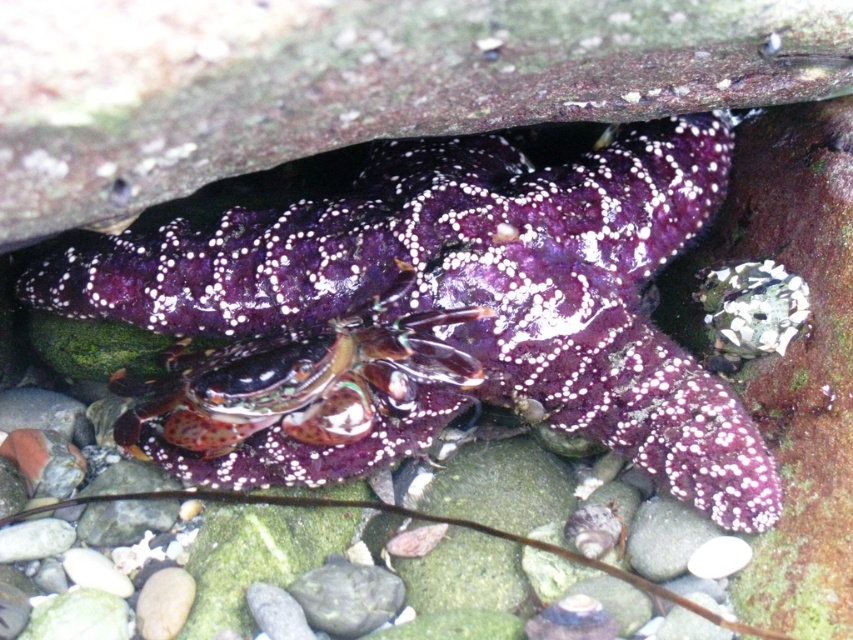
Question: Does purple glossy starfish at center have a lesser width compared to shiny purple hermit crab at center?

Choices:
 (A) yes
 (B) no

Answer: (B)

Question: Which of the following is the farthest from the observer?

Choices:
 (A) purple glossy starfish at center
 (B) shiny purple hermit crab at center

Answer: (A)

Question: Observing the image, what is the correct spatial positioning of purple glossy starfish at center in reference to shiny purple hermit crab at center?

Choices:
 (A) below
 (B) above

Answer: (B)

Question: Is the position of purple glossy starfish at center less distant than that of shiny purple hermit crab at center?

Choices:
 (A) yes
 (B) no

Answer: (B)

Question: Among these objects, which one is nearest to the camera?

Choices:
 (A) purple glossy starfish at center
 (B) shiny purple hermit crab at center

Answer: (B)